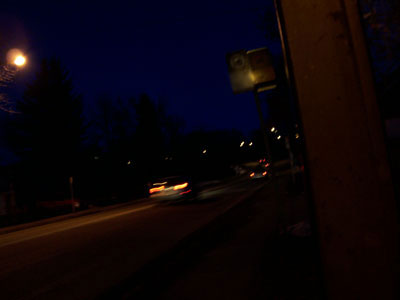
Identify the location of wooden beam on the left. The image size is (400, 300). (332, 71).